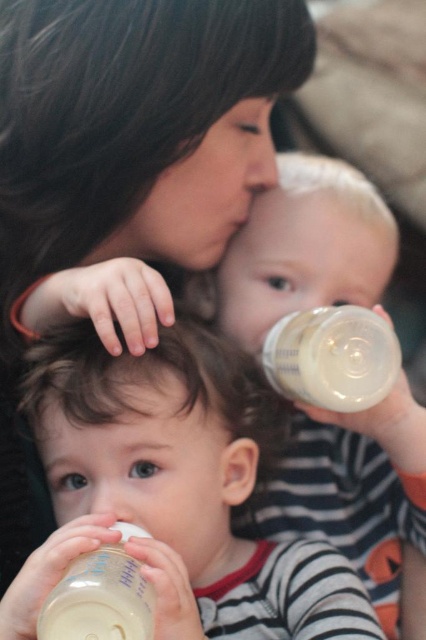
Question: Estimate the real-world distances between objects in this image. Which object is closer to the white opaque bottle at lower left?

Choices:
 (A) white glossy bottle at center
 (B) matte black hair at upper center
 (C) translucent plastic bottle at center
 (D) transparent plastic bottle at upper center

Answer: (A)

Question: Which point is closer to the camera taking this photo?

Choices:
 (A) (95, 220)
 (B) (175, 522)
 (C) (316, 369)
 (D) (100, 596)

Answer: (D)

Question: Estimate the real-world distances between objects in this image. Which object is farther from the white opaque bottle at lower left?

Choices:
 (A) matte black hair at upper center
 (B) translucent plastic bottle at center

Answer: (A)

Question: Can you confirm if matte black hair at upper center is positioned to the left of white opaque bottle at lower left?

Choices:
 (A) yes
 (B) no

Answer: (A)

Question: Is the position of matte black hair at upper center more distant than that of white opaque bottle at lower left?

Choices:
 (A) yes
 (B) no

Answer: (A)

Question: Does white glossy bottle at center appear under translucent plastic bottle at center?

Choices:
 (A) yes
 (B) no

Answer: (A)